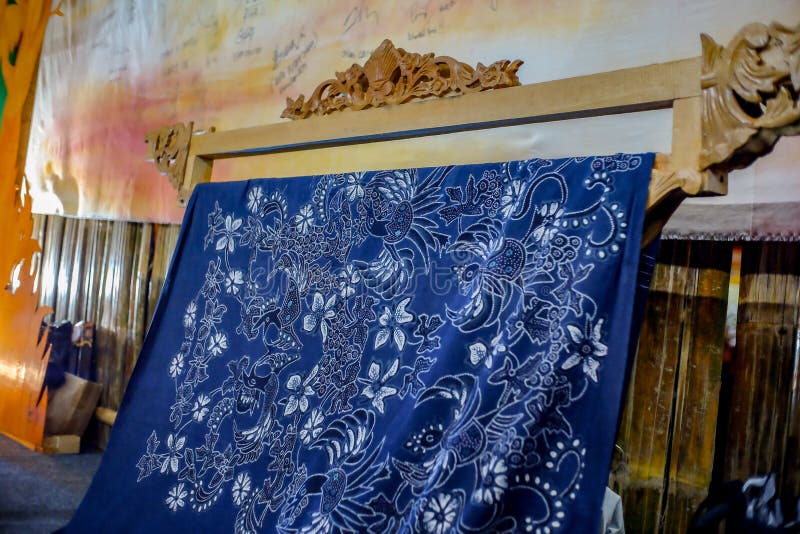
The image size is (800, 534). I want to click on blue textile, so tap(468, 389).